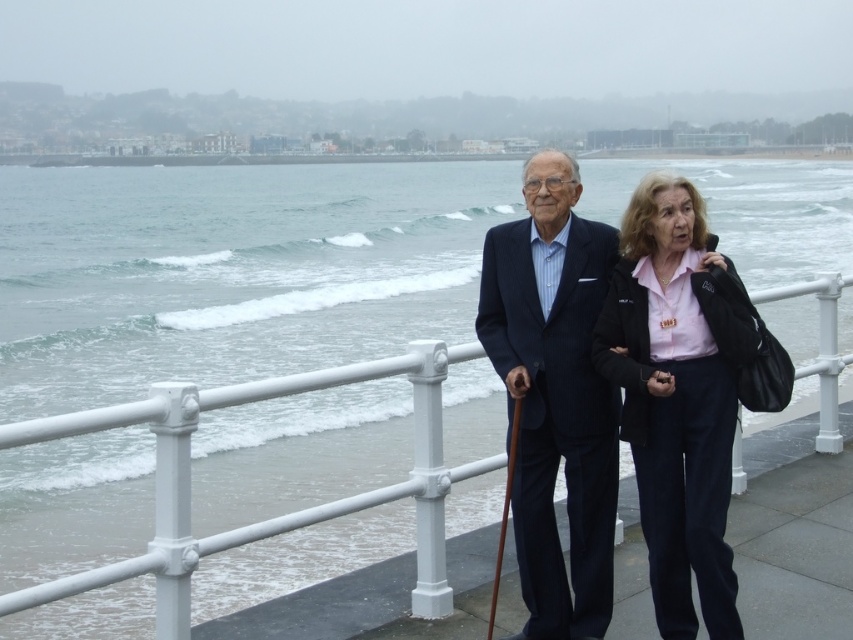
Is pink matte shirt at center shorter than dark blue pinstripe suit at center?

Yes.

Who is lower down, pink matte shirt at center or dark blue pinstripe suit at center?

Positioned lower is dark blue pinstripe suit at center.

Is point (734, 280) positioned in front of point (606, 620)?

Yes, it is in front of point (606, 620).

Identify the location of pink matte shirt at center. (677, 396).

How much distance is there between dark blue pinstripe suit at center and white metal railing at center?

dark blue pinstripe suit at center is 24.53 inches from white metal railing at center.

Find the location of a particular element. The height and width of the screenshot is (640, 853). dark blue pinstripe suit at center is located at coordinates (555, 396).

Locate an element on the screen. The height and width of the screenshot is (640, 853). dark blue pinstripe suit at center is located at coordinates (555, 396).

Is pink matte shirt at center wider than white metal railing at center?

Correct, the width of pink matte shirt at center exceeds that of white metal railing at center.

Who is more forward, (x=711, y=563) or (x=111, y=426)?

Positioned in front is point (x=111, y=426).

The width and height of the screenshot is (853, 640). I want to click on pink matte shirt at center, so click(x=677, y=396).